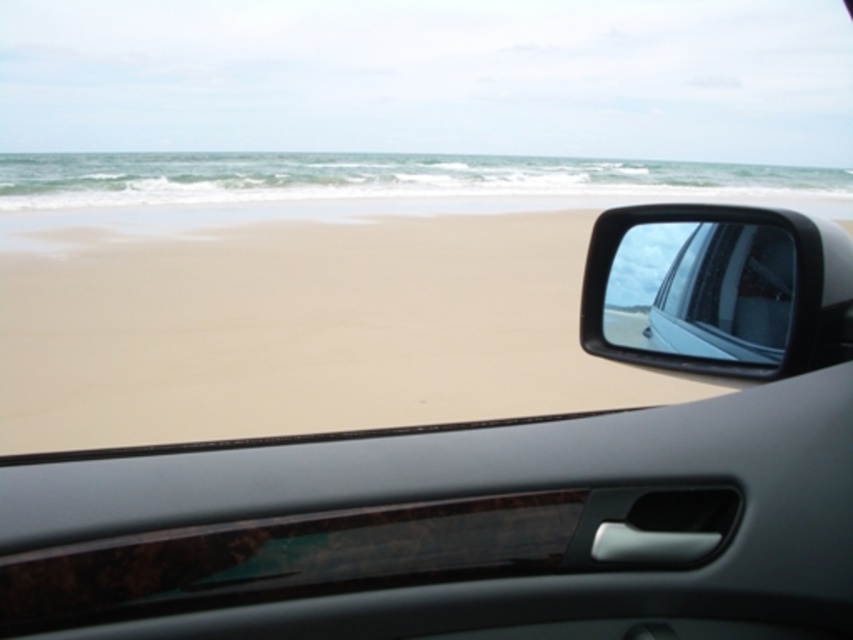
How far apart are sandy beach at lower left and glossy plastic car mirror at upper right?

3.57 meters

Is point (126, 330) positioned before point (700, 352)?

No, (126, 330) is further to viewer.

The height and width of the screenshot is (640, 853). In order to click on sandy beach at lower left in this screenshot , I will do `click(305, 332)`.

Where is `sandy beach at lower left`? This screenshot has height=640, width=853. sandy beach at lower left is located at coordinates (305, 332).